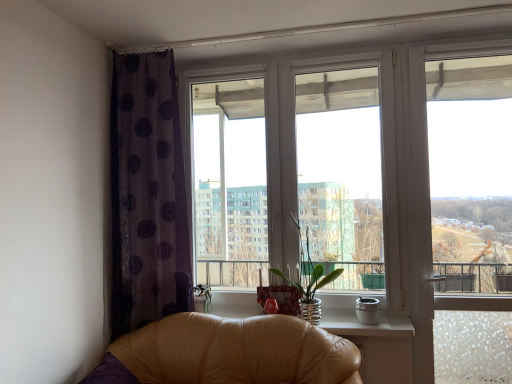
Where is `purple sheer curtain at left`? This screenshot has height=384, width=512. purple sheer curtain at left is located at coordinates (147, 193).

Describe the element at coordinates (147, 193) in the screenshot. I see `purple sheer curtain at left` at that location.

Image resolution: width=512 pixels, height=384 pixels. What are the coordinates of `clear glass vase at center` in the screenshot? It's located at (310, 276).

Locate an element on the screen. clear glass window at upper right is located at coordinates (471, 174).

Identify the location of purple sheer curtain at left. (147, 193).

In the image, is clear glass window at upper right on the left side or the right side of purple sheer curtain at left?

In the image, clear glass window at upper right appears on the right side of purple sheer curtain at left.

Considering the positions of point (508, 230) and point (166, 71), is point (508, 230) closer or farther from the camera than point (166, 71)?

Point (508, 230).

Find the location of a particular element. The height and width of the screenshot is (384, 512). window frame below the purple sheer curtain at left (from a real-world perspective) is located at coordinates (471, 174).

From the image's perspective, relative to purple sheer curtain at left, is clear glass window at upper right above or below?

clear glass window at upper right is below purple sheer curtain at left.

Who is smaller, clear glass vase at center or clear glass window at upper right?

With smaller size is clear glass window at upper right.

Can clear glass window at upper right be found inside clear glass vase at center?

No, clear glass window at upper right is located outside of clear glass vase at center.

Does point (325, 281) come farther from viewer compared to point (486, 133)?

That is False.

Find the location of a particular element. The image size is (512, 384). window frame above the clear glass vase at center (from a real-world perspective) is located at coordinates (471, 174).

Is purple sheer curtain at left spatially inside leather chair at lower left, or outside of it?

purple sheer curtain at left exists outside the volume of leather chair at lower left.

Is point (141, 224) positioned before point (105, 362)?

No, it is behind (105, 362).

From a real-world perspective, is purple sheer curtain at left under leather chair at lower left?

No, from a real-world perspective, purple sheer curtain at left is not beneath leather chair at lower left.

Are purple sheer curtain at left and leather chair at lower left located far from each other?

purple sheer curtain at left is actually quite close to leather chair at lower left.

From the image's perspective, is leather chair at lower left located above clear glass window at upper right?

No, from the image's perspective, leather chair at lower left is not over clear glass window at upper right.

Are leather chair at lower left and clear glass window at upper right located far from each other?

Absolutely, leather chair at lower left is distant from clear glass window at upper right.

Considering the sizes of objects leather chair at lower left and clear glass window at upper right in the image provided, who is smaller, leather chair at lower left or clear glass window at upper right?

clear glass window at upper right.

Does leather chair at lower left have a greater width compared to clear glass window at upper right?

Correct, the width of leather chair at lower left exceeds that of clear glass window at upper right.

Does clear glass window at upper right have a lesser height compared to clear glass vase at center?

No.

Is clear glass window at upper right next to clear glass vase at center?

No, clear glass window at upper right is not next to clear glass vase at center.

Which of these two, clear glass window at upper right or clear glass vase at center, is wider?

Wider between the two is clear glass vase at center.

You are a GUI agent. You are given a task and a screenshot of the screen. Output one action in this format:
    pyautogui.click(x=<x>, y=<y>)
    Task: Click on the plant behind the clear glass window at upper right
    The height and width of the screenshot is (384, 512).
    Given the screenshot: What is the action you would take?
    pyautogui.click(x=310, y=276)

Is purple sheer curtain at left facing away from transparent glass window at center?

No, transparent glass window at center is not at the back of purple sheer curtain at left.

Find the location of `window behind the purple sheer curtain at left`. window behind the purple sheer curtain at left is located at coordinates (292, 168).

From the image's perspective, is purple sheer curtain at left located beneath transparent glass window at center?

Yes.

Considering the positions of objects purple sheer curtain at left and transparent glass window at center in the image provided, who is behind, purple sheer curtain at left or transparent glass window at center?

Positioned behind is transparent glass window at center.

Which object is wider, transparent glass window at center or purple sheer curtain at left?

purple sheer curtain at left.

Between transparent glass window at center and purple sheer curtain at left, which one has larger size?

With larger size is transparent glass window at center.

From a real-world perspective, between transparent glass window at center and purple sheer curtain at left, who is vertically lower?

From a 3D spatial view, purple sheer curtain at left is below.

Identify the location of curtain located above the clear glass window at upper right (from the image's perspective). (147, 193).

Where is `plant behind the clear glass window at upper right`? plant behind the clear glass window at upper right is located at coordinates (310, 276).

When comparing their distances from clear glass vase at center, does leather chair at lower left or transparent glass window at center seem further?

leather chair at lower left is further to clear glass vase at center.

Estimate the real-world distances between objects in this image. Which object is closer to transparent glass window at center, clear glass vase at center or leather chair at lower left?

clear glass vase at center is positioned closer to the anchor transparent glass window at center.

Based on their spatial positions, is clear glass vase at center or clear glass window at upper right further from purple sheer curtain at left?

The object further to purple sheer curtain at left is clear glass window at upper right.

Looking at the image, which one is located closer to leather chair at lower left, transparent glass window at center or clear glass window at upper right?

transparent glass window at center is closer to leather chair at lower left.

From the image, which object appears to be nearer to purple sheer curtain at left, clear glass vase at center or leather chair at lower left?

leather chair at lower left is positioned closer to the anchor purple sheer curtain at left.

Based on the photo, based on their spatial positions, is purple sheer curtain at left or clear glass window at upper right further from leather chair at lower left?

clear glass window at upper right is positioned further to the anchor leather chair at lower left.

From the image, which object appears to be farther from purple sheer curtain at left, clear glass vase at center or transparent glass window at center?

clear glass vase at center lies further to purple sheer curtain at left than the other object.

Estimate the real-world distances between objects in this image. Which object is further from transparent glass window at center, clear glass window at upper right or purple sheer curtain at left?

Among the two, clear glass window at upper right is located further to transparent glass window at center.

The height and width of the screenshot is (384, 512). Identify the location of window between purple sheer curtain at left and clear glass vase at center. (292, 168).

This screenshot has height=384, width=512. I want to click on curtain between leather chair at lower left and transparent glass window at center in the front-back direction, so click(x=147, y=193).

Where is `window between purple sheer curtain at left and clear glass window at upper right in the horizontal direction`? The width and height of the screenshot is (512, 384). window between purple sheer curtain at left and clear glass window at upper right in the horizontal direction is located at coordinates (292, 168).

Identify the location of plant between purple sheer curtain at left and clear glass window at upper right in the horizontal direction. (310, 276).